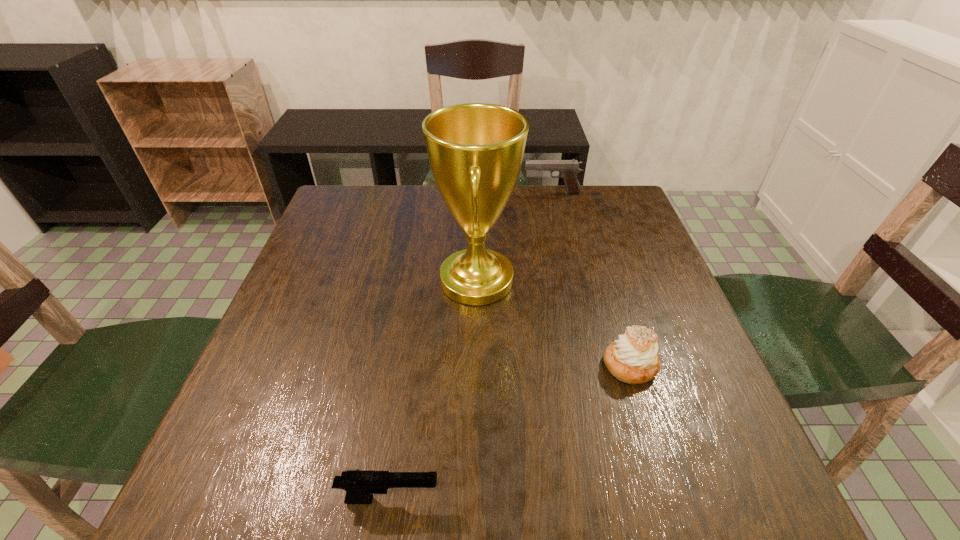
At what (x,y) coordinates should I click in order to perform the action: click on vacant space at the right edge. Please return your answer as a coordinate pair (x, y). Looking at the image, I should click on click(x=719, y=389).

At what (x,y) coordinates should I click in order to perform the action: click on free space at the far right corner. Please return your answer as a coordinate pair (x, y). The height and width of the screenshot is (540, 960). Looking at the image, I should click on (624, 200).

The width and height of the screenshot is (960, 540). Identify the location of blank region between the right pistol and the second nearest object. (591, 279).

Image resolution: width=960 pixels, height=540 pixels. I want to click on free spot between the farthest object and the second farthest object, so click(x=515, y=237).

Image resolution: width=960 pixels, height=540 pixels. I want to click on unoccupied position between the third shortest object and the left pistol, so click(x=471, y=346).

Identify the location of vacant area between the nearest object and the pastry. (510, 432).

Where is `vacant space in between the award and the farther pistol`? vacant space in between the award and the farther pistol is located at coordinates (515, 237).

What are the coordinates of `free point between the tallest object and the right pistol` in the screenshot? It's located at (515, 237).

Locate an element on the screen. This screenshot has height=540, width=960. free space between the left pistol and the third farthest object is located at coordinates (510, 432).

You are a GUI agent. You are given a task and a screenshot of the screen. Output one action in this format:
    pyautogui.click(x=<x>, y=<y>)
    Task: Click on the vacant area that lies between the nearest object and the second farthest object
    
    Given the screenshot: What is the action you would take?
    pyautogui.click(x=433, y=390)